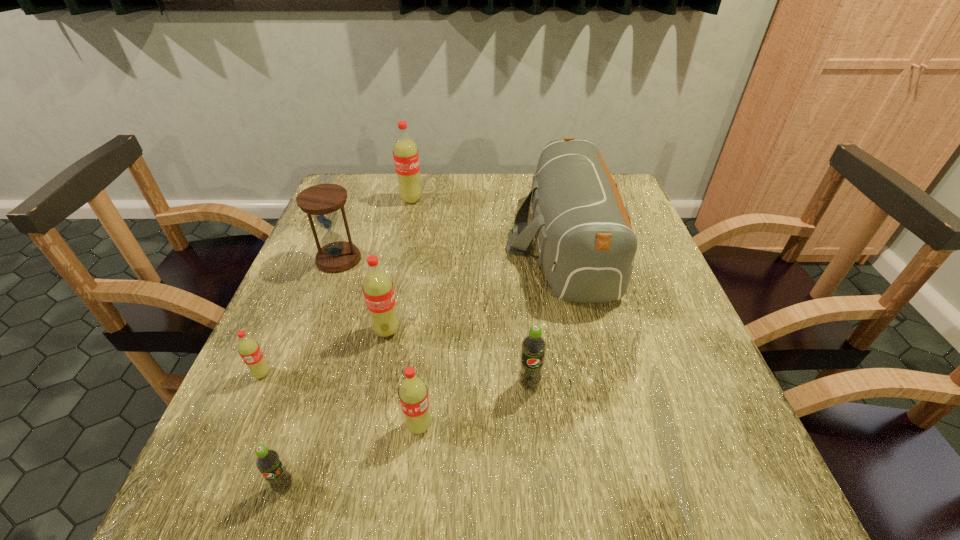
Locate an element on the screen. The image size is (960, 540). vacant area that lies between the hourglass and the fifth nearest soda is located at coordinates (363, 295).

I want to click on free point between the bigger green soda and the second nearest red soda, so click(x=396, y=379).

Choose which object is the third nearest neighbor to the fifth nearest object. Please provide its 2D coordinates. Your answer should be formatted as a tuple, i.e. [(x, y)], where the tuple contains the x and y coordinates of a point satisfying the conditions above.

[(249, 350)]

Identify which object is the fourth nearest to the hourglass. Please provide its 2D coordinates. Your answer should be formatted as a tuple, i.e. [(x, y)], where the tuple contains the x and y coordinates of a point satisfying the conditions above.

[(586, 244)]

Where is `soda that is the nearest to the tallest soda`? The image size is (960, 540). soda that is the nearest to the tallest soda is located at coordinates (378, 290).

Image resolution: width=960 pixels, height=540 pixels. I want to click on the fifth closest soda to the second nearest object, so click(x=405, y=152).

Point out which red soda is positioned as the nearest to the second soda from right to left. Please provide its 2D coordinates. Your answer should be formatted as a tuple, i.e. [(x, y)], where the tuple contains the x and y coordinates of a point satisfying the conditions above.

[(378, 290)]

Locate an element on the screen. The image size is (960, 540). red soda identified as the third closest to the rightmost red soda is located at coordinates (405, 152).